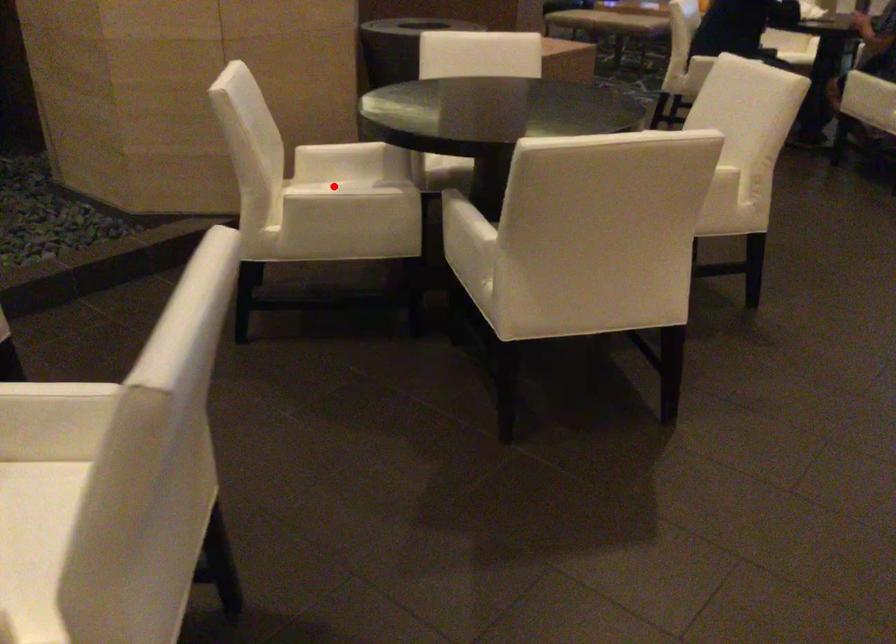
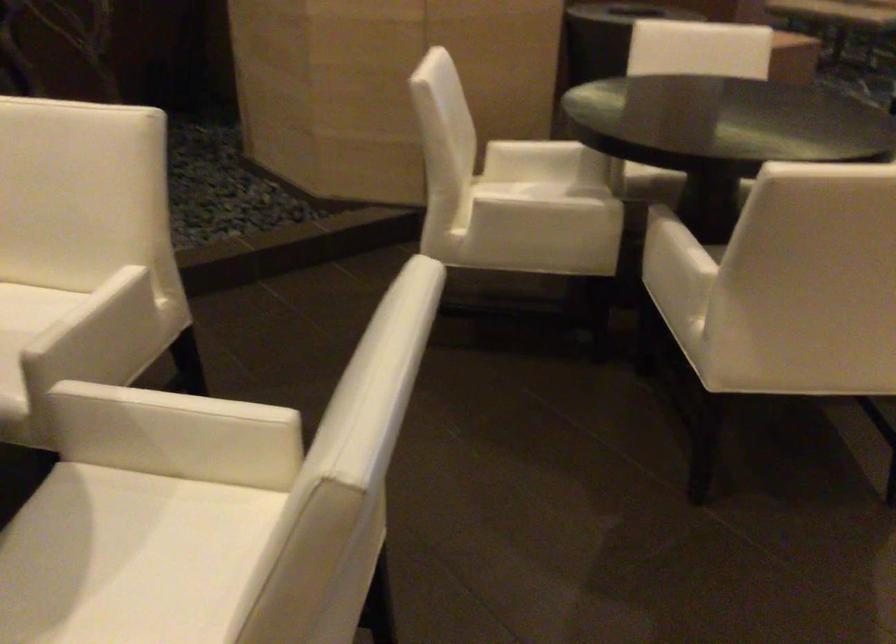
Question: I am providing you with two images of the same scene from different viewpoints. Given a red point in image1, look at the same physical point in image2. Is it:

Choices:
 (A) Closer to the viewpoint
 (B) Farther from the viewpoint

Answer: (A)